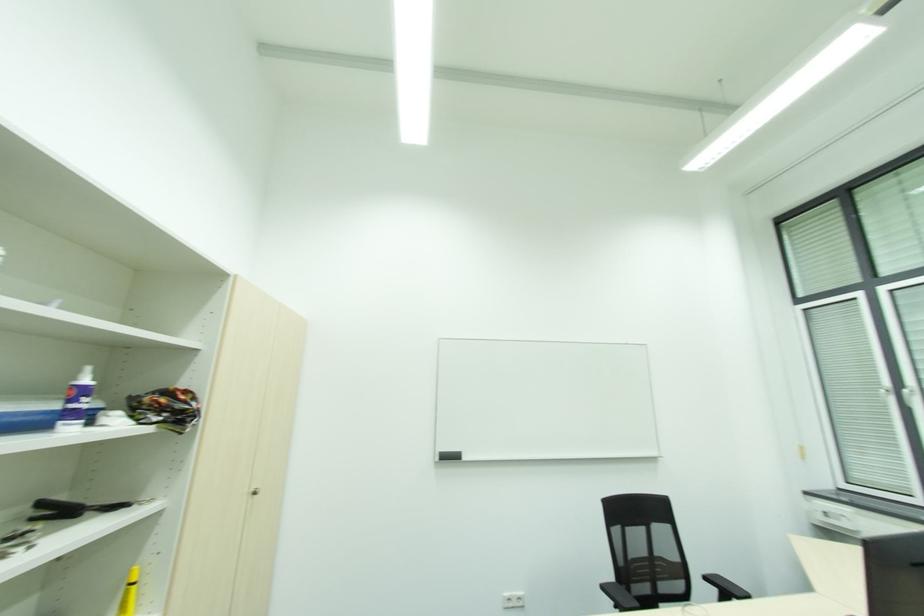
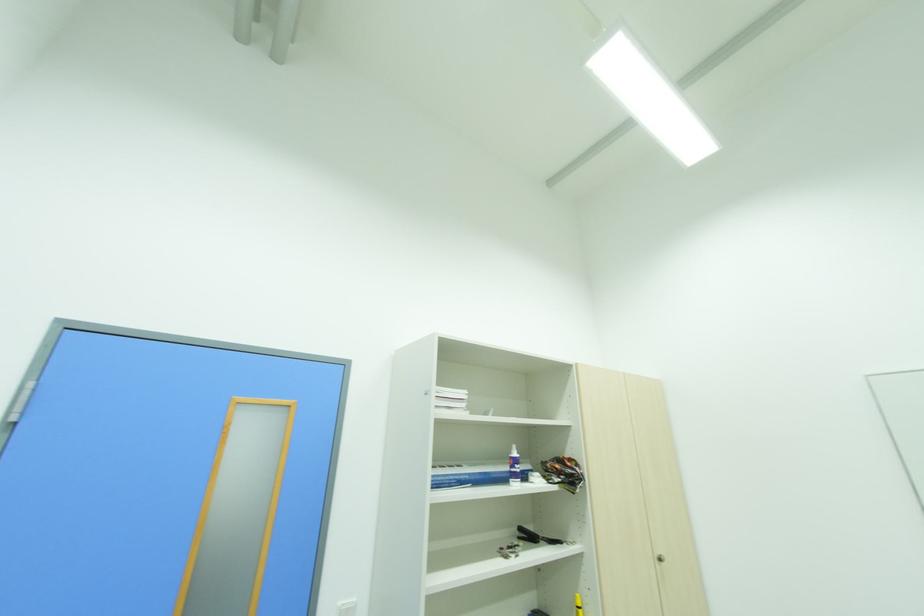
Where in the second image is the point corresponding to the point at 73,512 from the first image?

(536, 539)